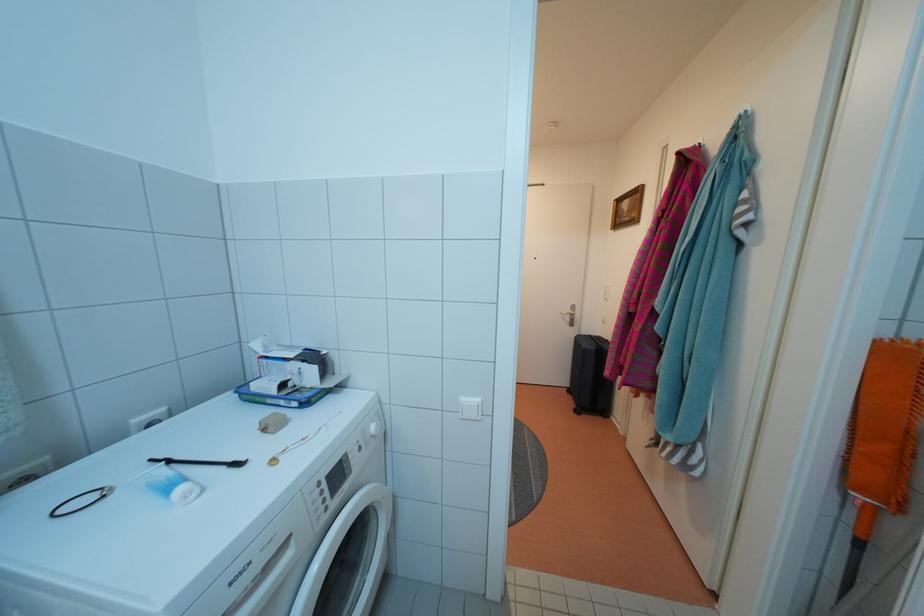
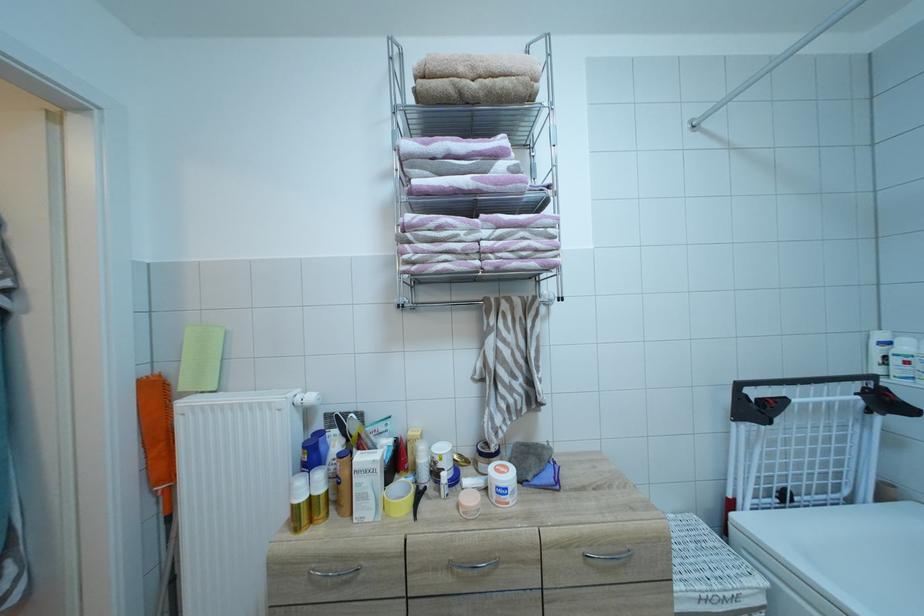
Question: Based on the continuous images, in which direction is the camera rotating? Reply with the corresponding letter.

Choices:
 (A) Left
 (B) Right
 (C) Up
 (D) Down

Answer: (B)